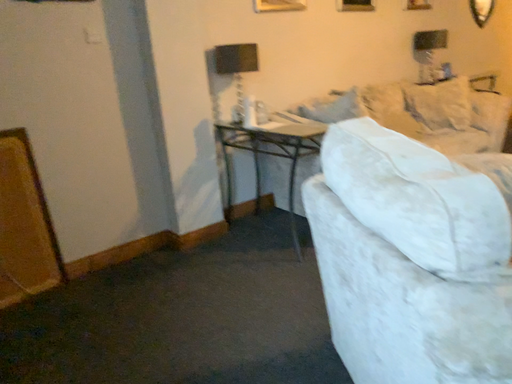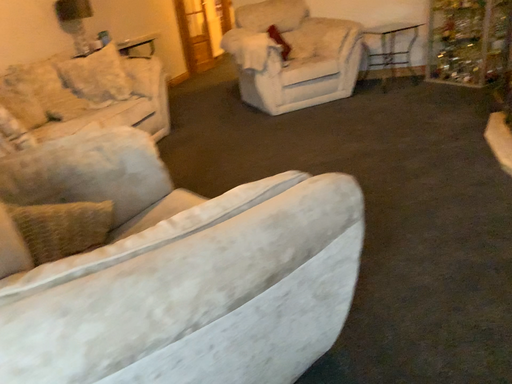
Question: Which way did the camera rotate in the video?

Choices:
 (A) rotated right
 (B) rotated left

Answer: (A)